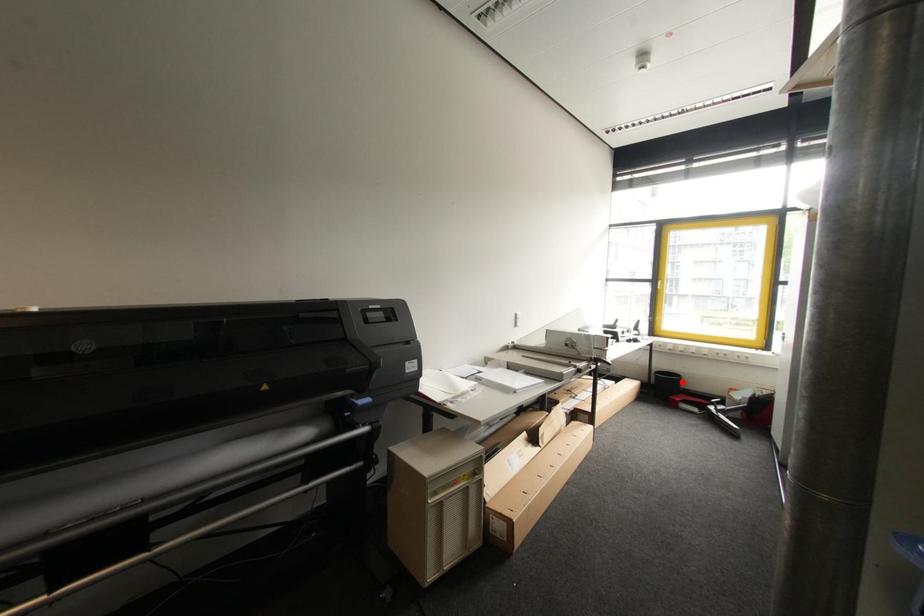
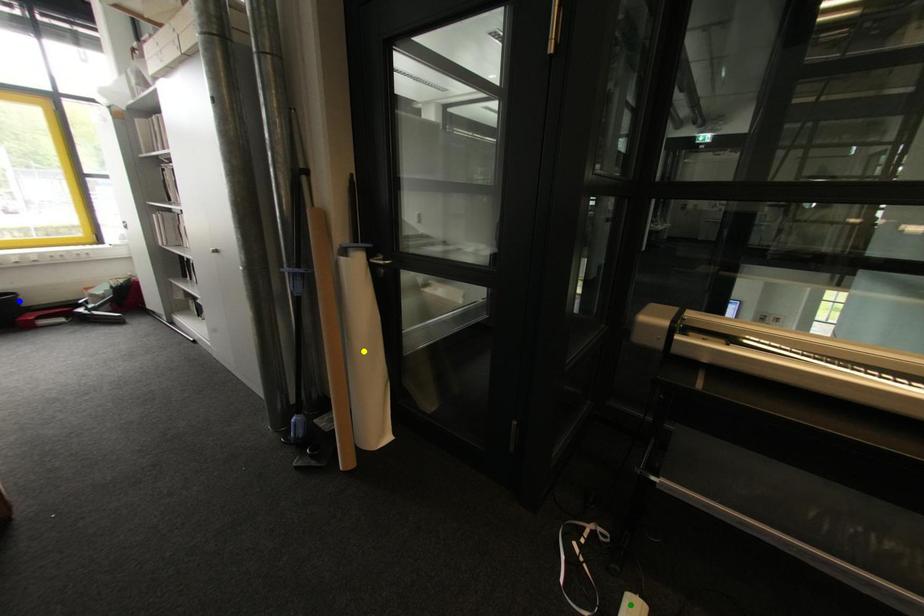
Question: I am providing you with two images of the same scene from different viewpoints. A red point is marked on the first image. You are given multiple points on the second image. Which mark in image 2 goes with the point in image 1?

Choices:
 (A) blue point
 (B) green point
 (C) yellow point

Answer: (A)